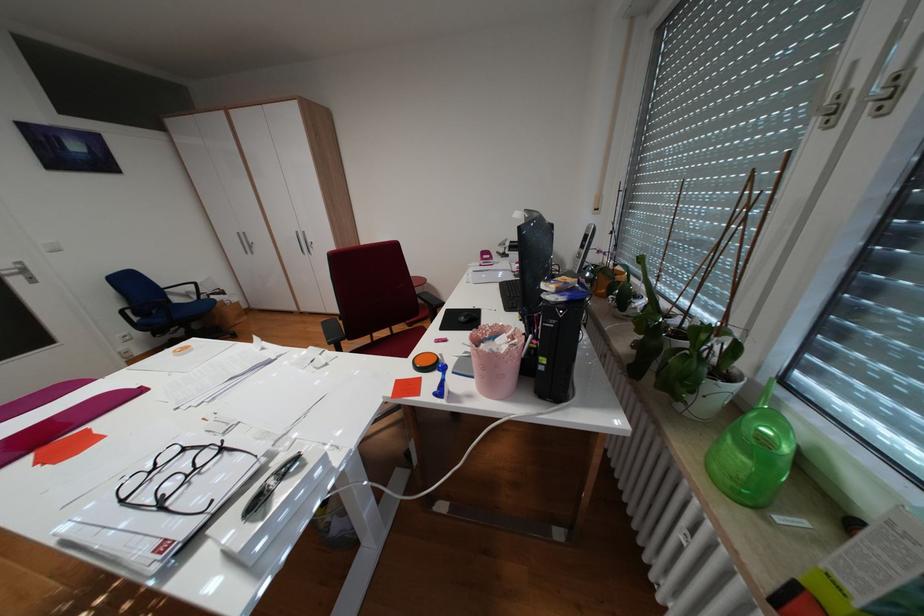
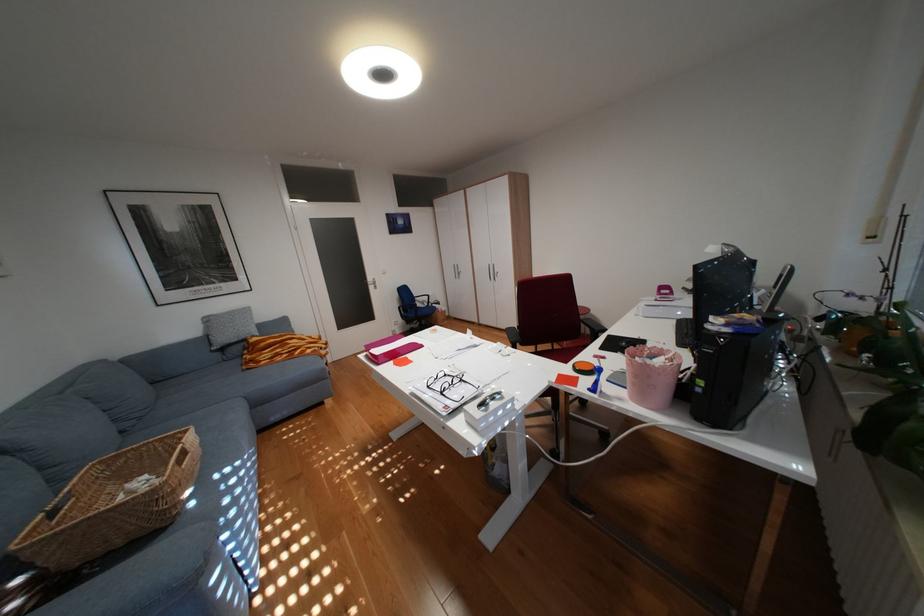
The point at (494, 257) is marked in the first image. Where is the corresponding point in the second image?

(672, 293)